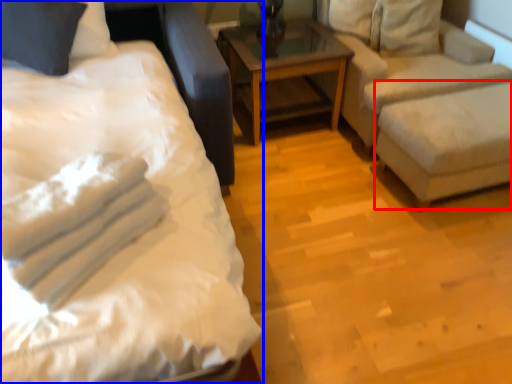
Question: Which of the following is the closest to the observer, swivel chair (highlighted by a red box) or bed (highlighted by a blue box)?

Choices:
 (A) swivel chair
 (B) bed

Answer: (B)